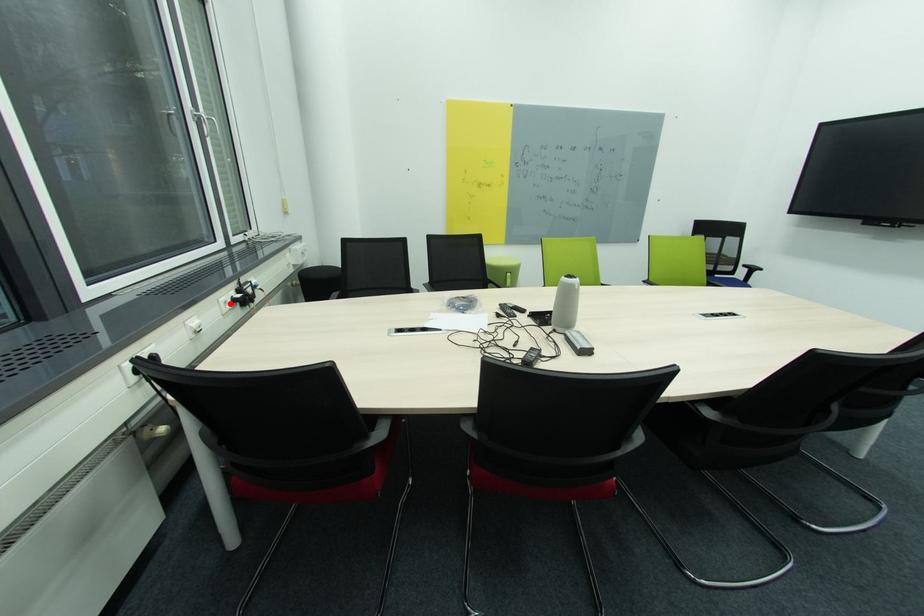
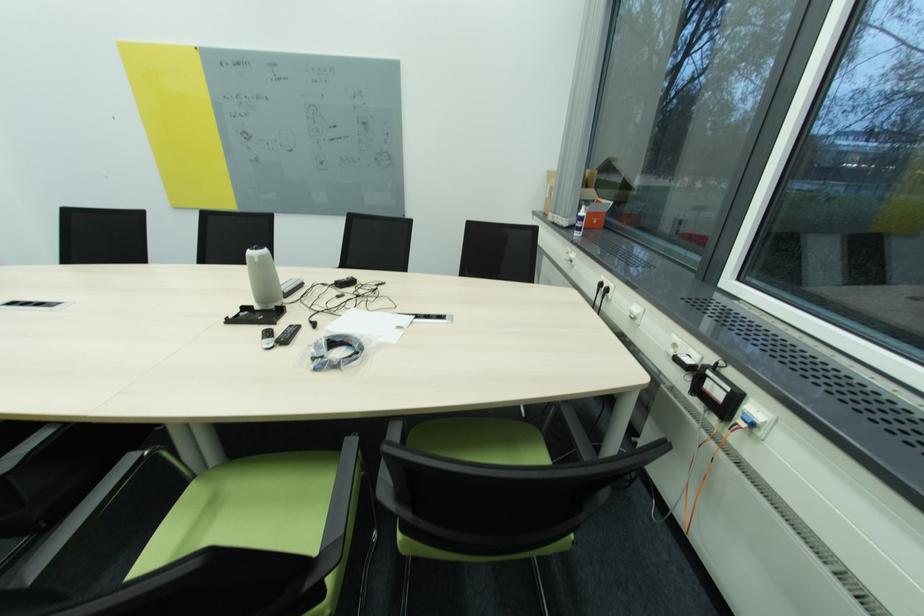
In the second image, find the point that corresponds to the highlighted location in the first image.

(679, 346)